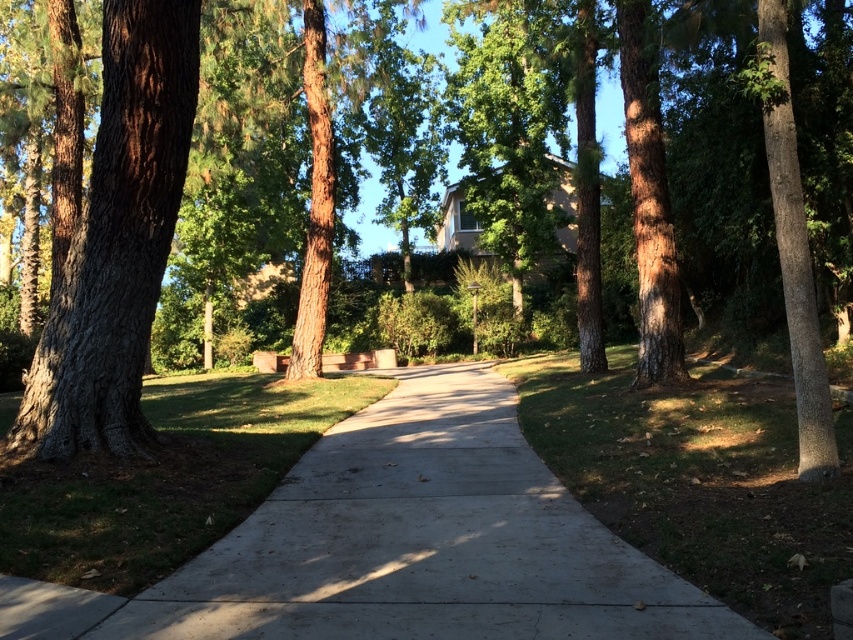
Question: Which object appears farthest from the camera in this image?

Choices:
 (A) concrete at center
 (B) smooth brown tree trunk at left

Answer: (B)

Question: Is concrete at center in front of smooth brown tree trunk at left?

Choices:
 (A) yes
 (B) no

Answer: (A)

Question: From the image, what is the correct spatial relationship of concrete at center in relation to smooth brown tree trunk at left?

Choices:
 (A) right
 (B) left

Answer: (A)

Question: Can you confirm if concrete at center is positioned below smooth brown tree trunk at left?

Choices:
 (A) yes
 (B) no

Answer: (A)